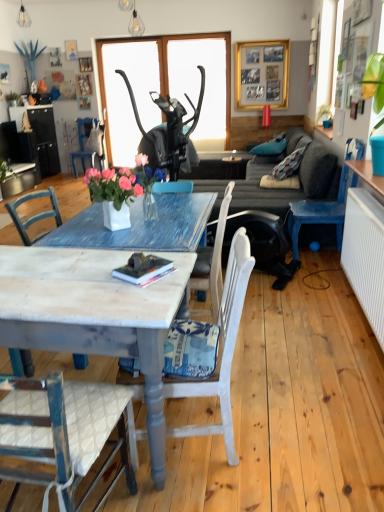
You are a GUI agent. You are given a task and a screenshot of the screen. Output one action in this format:
    pyautogui.click(x=<x>, y=<y>)
    Task: Click on the unoccupied area in front of hardcover book at center
    
    Given the screenshot: What is the action you would take?
    pyautogui.click(x=140, y=298)